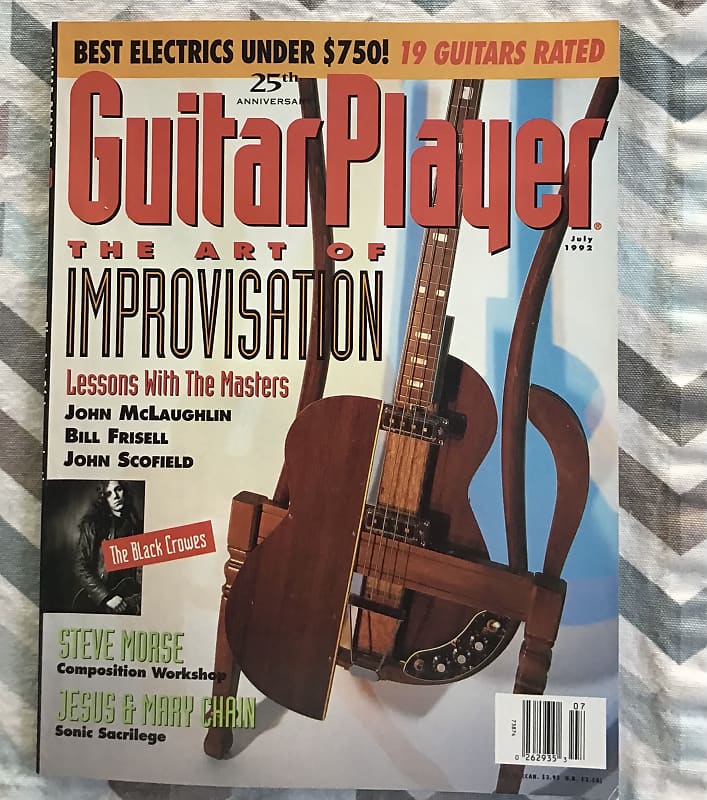
The width and height of the screenshot is (707, 800). Identify the location of table cloth. (686, 422).